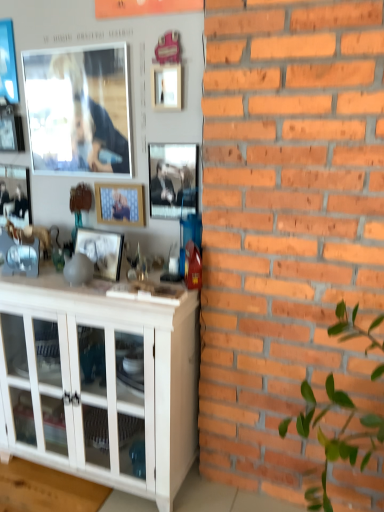
Question: From a real-world perspective, is metallic blue picture frame at upper left, which is the eighth picture frame from right to left, under metallic silver picture frame at center, which is counted as the eighth picture frame, starting from the left?

Choices:
 (A) no
 (B) yes

Answer: (A)

Question: Is metallic blue picture frame at upper left, which is the eighth picture frame from right to left, far away from metallic silver picture frame at center, which is counted as the eighth picture frame, starting from the left?

Choices:
 (A) yes
 (B) no

Answer: (B)

Question: Does metallic blue picture frame at upper left, the first picture frame positioned from the left, contain metallic silver picture frame at center, which is counted as the eighth picture frame, starting from the left?

Choices:
 (A) no
 (B) yes

Answer: (A)

Question: Can you confirm if metallic blue picture frame at upper left, the first picture frame positioned from the left, is positioned to the right of metallic silver picture frame at center, positioned as the first picture frame in right-to-left order?

Choices:
 (A) yes
 (B) no

Answer: (B)

Question: Is metallic blue picture frame at upper left, the first picture frame positioned from the left, smaller than metallic silver picture frame at center, which is counted as the eighth picture frame, starting from the left?

Choices:
 (A) no
 (B) yes

Answer: (B)

Question: Considering the relative sizes of metallic blue picture frame at upper left, the first picture frame positioned from the left, and metallic silver picture frame at center, which is counted as the eighth picture frame, starting from the left, in the image provided, is metallic blue picture frame at upper left, the first picture frame positioned from the left, wider than metallic silver picture frame at center, which is counted as the eighth picture frame, starting from the left,?

Choices:
 (A) yes
 (B) no

Answer: (B)

Question: Could you tell me if matte wooden picture frame at center, marked as the fifth picture frame in a left-to-right arrangement, is facing wooden frame at center, the 3th picture frame in the right-to-left sequence?

Choices:
 (A) yes
 (B) no

Answer: (B)

Question: Is matte wooden picture frame at center, the fourth picture frame positioned from the right, positioned beyond the bounds of wooden frame at center, acting as the 6th picture frame starting from the left?

Choices:
 (A) yes
 (B) no

Answer: (A)

Question: Is matte wooden picture frame at center, the fourth picture frame positioned from the right, taller than wooden frame at center, the 3th picture frame in the right-to-left sequence?

Choices:
 (A) no
 (B) yes

Answer: (A)

Question: Are matte wooden picture frame at center, marked as the fifth picture frame in a left-to-right arrangement, and wooden frame at center, the 3th picture frame in the right-to-left sequence, located far from each other?

Choices:
 (A) yes
 (B) no

Answer: (B)

Question: From the image's perspective, does matte wooden picture frame at center, marked as the fifth picture frame in a left-to-right arrangement, appear lower than wooden frame at center, acting as the 6th picture frame starting from the left?

Choices:
 (A) yes
 (B) no

Answer: (A)

Question: Does matte wooden picture frame at center, marked as the fifth picture frame in a left-to-right arrangement, have a smaller size compared to wooden frame at center, acting as the 6th picture frame starting from the left?

Choices:
 (A) yes
 (B) no

Answer: (B)

Question: Can you confirm if matte black picture frame at left, which is the second picture frame in left-to-right order, is smaller than white glossy cabinet at lower left?

Choices:
 (A) yes
 (B) no

Answer: (A)